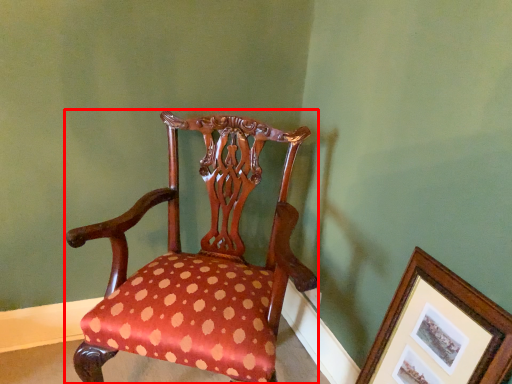
Question: Where is chair (annotated by the red box) located in relation to picture frame in the image?

Choices:
 (A) right
 (B) left

Answer: (B)